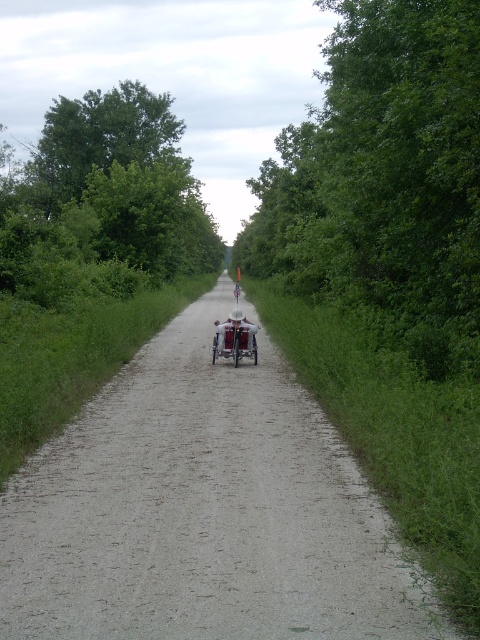
Question: In this image, where is gray gravel path at center located relative to metallic silver baby carriage at center?

Choices:
 (A) right
 (B) left

Answer: (B)

Question: Observing the image, what is the correct spatial positioning of green leafy tree at center in reference to metallic silver baby carriage at center?

Choices:
 (A) right
 (B) left

Answer: (A)

Question: From the image, what is the correct spatial relationship of gray gravel path at center in relation to green leafy tree at left?

Choices:
 (A) above
 (B) below

Answer: (B)

Question: Which point is farther from the camera taking this photo?

Choices:
 (A) (96, 490)
 (B) (84, 115)
 (C) (457, 310)
 (D) (232, 314)

Answer: (B)

Question: Considering the real-world distances, which object is closest to the green leafy tree at center?

Choices:
 (A) gray gravel path at center
 (B) green leafy tree at left
 (C) metallic silver baby carriage at center

Answer: (B)

Question: Which point is closer to the camera taking this photo?

Choices:
 (A) (106, 248)
 (B) (271, 176)
 (C) (237, 349)
 (D) (239, 593)

Answer: (D)